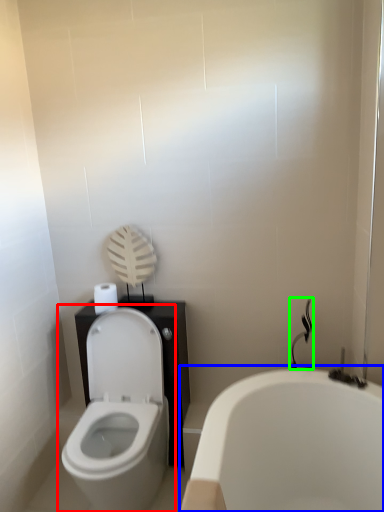
Question: Estimate the real-world distances between objects in this image. Which object is closer to toilet (highlighted by a red box), bathtub (highlighted by a blue box) or shower (highlighted by a green box)?

Choices:
 (A) bathtub
 (B) shower

Answer: (A)